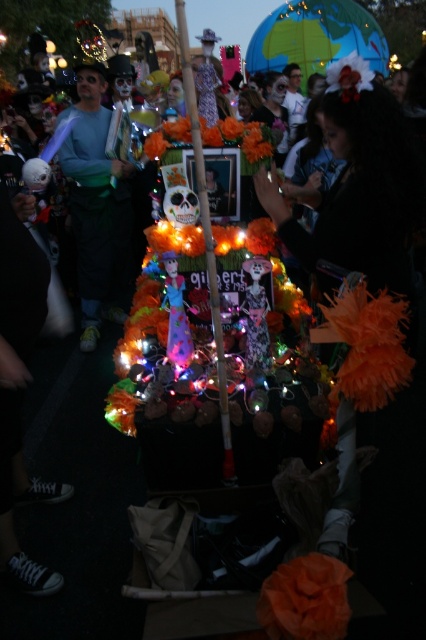
Question: Does matte green shirt at center have a larger size compared to wooden stick at center?

Choices:
 (A) no
 (B) yes

Answer: (B)

Question: Which point is closer to the camera?

Choices:
 (A) wooden stick at center
 (B) matte green shirt at center

Answer: (A)

Question: Does matte green shirt at center have a greater width compared to wooden stick at center?

Choices:
 (A) yes
 (B) no

Answer: (A)

Question: Considering the relative positions of matte green shirt at center and wooden stick at center in the image provided, where is matte green shirt at center located with respect to wooden stick at center?

Choices:
 (A) right
 (B) left

Answer: (B)

Question: Which point appears farthest from the camera in this image?

Choices:
 (A) (74, 141)
 (B) (210, 300)

Answer: (A)